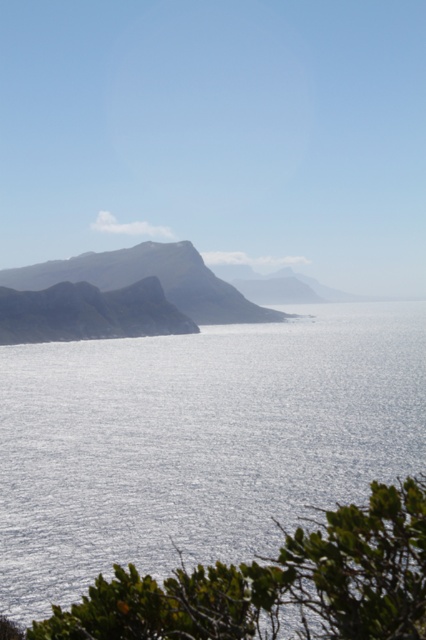
Question: Considering the relative positions of green leafy shrub at lower right and smooth gray rock at center in the image provided, where is green leafy shrub at lower right located with respect to smooth gray rock at center?

Choices:
 (A) right
 (B) left

Answer: (A)

Question: Is green leafy shrub at lower right further to camera compared to smooth gray rock at center?

Choices:
 (A) yes
 (B) no

Answer: (B)

Question: Observing the image, what is the correct spatial positioning of glistening silver water at center in reference to green leafy shrub at lower right?

Choices:
 (A) above
 (B) below

Answer: (A)

Question: Which object is closer to the camera taking this photo?

Choices:
 (A) smooth gray rock at center
 (B) green leafy shrub at lower right
 (C) glistening silver water at center

Answer: (B)

Question: Which object is the closest to the smooth gray rock at center?

Choices:
 (A) green leafy shrub at lower right
 (B) glistening silver water at center

Answer: (B)

Question: Which of the following is the closest to the observer?

Choices:
 (A) green leafy shrub at lower right
 (B) smooth gray rock at center

Answer: (A)